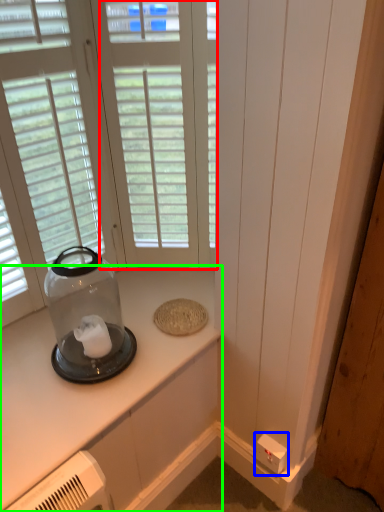
Question: Which is nearer to the window (highlighted by a red box)? electric outlet (highlighted by a blue box) or countertop (highlighted by a green box).

Choices:
 (A) electric outlet
 (B) countertop

Answer: (B)